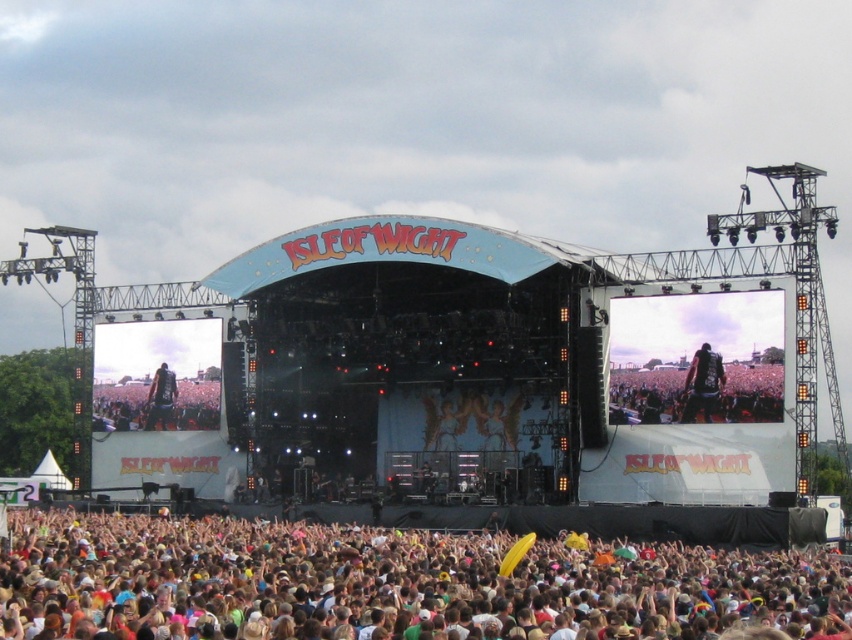
Does dark brown leather jacket at center come behind dark blue leather jacket at center?

That is False.

Between dark brown leather jacket at center and dark blue leather jacket at center, which one is positioned higher?

dark brown leather jacket at center

Is point (684, 419) positioned before point (173, 385)?

Yes, point (684, 419) is in front of point (173, 385).

The image size is (852, 640). What are the coordinates of `dark brown leather jacket at center` in the screenshot? It's located at (701, 384).

Which is more to the right, multicolored fabric crowd at lower center or dark blue fabric at center?

From the viewer's perspective, multicolored fabric crowd at lower center appears more on the right side.

Can you confirm if multicolored fabric crowd at lower center is positioned above dark blue fabric at center?

No.

The image size is (852, 640). What are the coordinates of `multicolored fabric crowd at lower center` in the screenshot? It's located at (390, 582).

Does dark blue fabric at center lie behind dark blue leather jacket at center?

No.

Is point (210, 381) less distant than point (160, 376)?

Yes, it is.

In order to click on dark blue fabric at center in this screenshot , I will do `click(158, 401)`.

Locate an element on the screen. This screenshot has height=640, width=852. dark blue fabric at center is located at coordinates (158, 401).